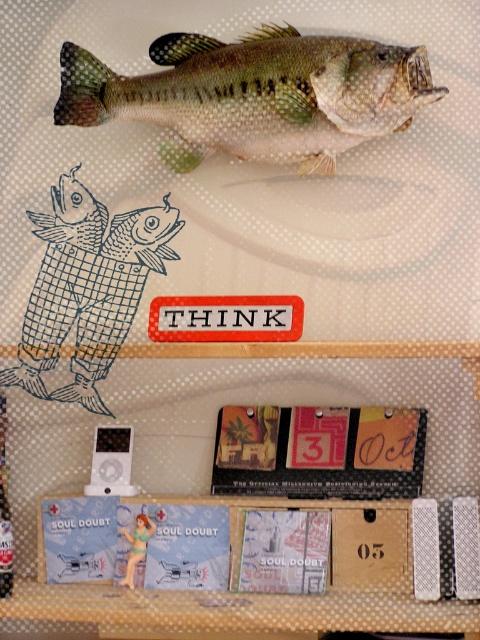
Can you confirm if green matte fish at upper center is wider than matte black calendar at center?

Yes.

Is point (333, 44) less distant than point (345, 444)?

That is True.

Is point (93, 70) positioned after point (367, 416)?

That is False.

You are a GUI agent. You are given a task and a screenshot of the screen. Output one action in this format:
    pyautogui.click(x=<x>, y=<y>)
    Task: Click on the green matte fish at upper center
    This screenshot has height=640, width=480.
    Given the screenshot: What is the action you would take?
    pyautogui.click(x=254, y=93)

Is blue checkered fish at upper left below wooden box at center?

No, blue checkered fish at upper left is not below wooden box at center.

What do you see at coordinates (87, 288) in the screenshot? Image resolution: width=480 pixels, height=640 pixels. I see `blue checkered fish at upper left` at bounding box center [87, 288].

Who is more distant from viewer, (121, 250) or (276, 355)?

The point (121, 250) is more distant.

The height and width of the screenshot is (640, 480). Identify the location of blue checkered fish at upper left. (87, 288).

Who is positioned more to the right, green matte fish at upper center or wooden box at center?

green matte fish at upper center

Between green matte fish at upper center and wooden box at center, which one is positioned lower?

Positioned lower is wooden box at center.

Is point (245, 49) closer to camera compared to point (396, 611)?

No, (245, 49) is further to viewer.

Where is `green matte fish at upper center`? The width and height of the screenshot is (480, 640). green matte fish at upper center is located at coordinates (254, 93).